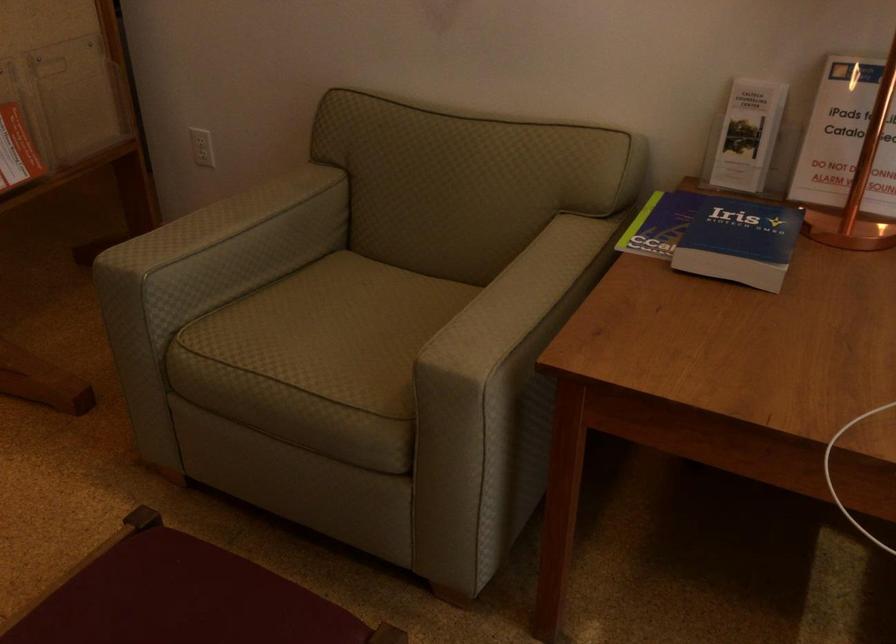
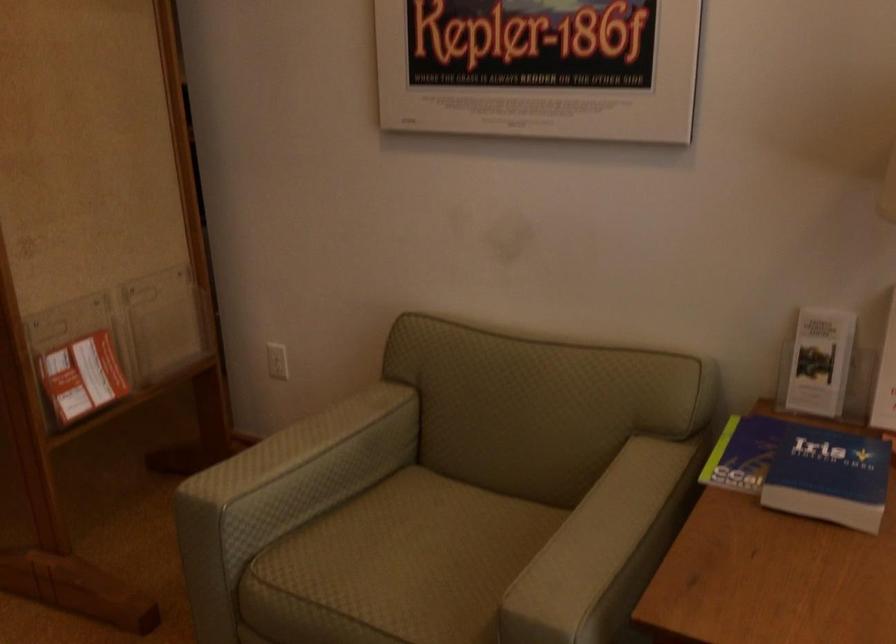
Locate, in the second image, the point that corresponds to [202,144] in the first image.

(277, 361)